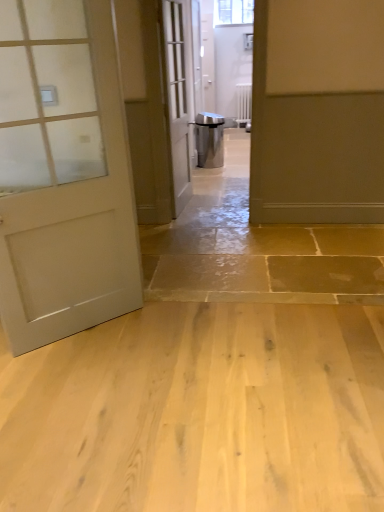
Locate an element on the screen. matte gray door at right, which is the first door from back to front is located at coordinates (317, 112).

Locate an element on the screen. The width and height of the screenshot is (384, 512). white glass door at center, the 2th door when ordered from back to front is located at coordinates (179, 96).

Describe the element at coordinates (63, 174) in the screenshot. The height and width of the screenshot is (512, 384). I see `matte white door at left, the third door viewed from the back` at that location.

I want to click on white painted metal radiator at center, so click(244, 104).

Measure the distance between point (x=237, y=16) and camera.

Point (x=237, y=16) is 7.30 meters away from camera.

Where is `clear glass window at upper center`? The image size is (384, 512). clear glass window at upper center is located at coordinates (233, 12).

What are the coordinates of `matte gray door at right, the third door when ordered from front to back` in the screenshot? It's located at (317, 112).

The width and height of the screenshot is (384, 512). I want to click on concrete located below the white painted metal radiator at center (from the image's perspective), so click(x=199, y=412).

Who is smaller, light brown wood flooring at center or white painted metal radiator at center?

Smaller between the two is white painted metal radiator at center.

Which is closer to the camera, (23,422) or (251,110)?

The point (23,422) is closer.

Does white painted metal radiator at center have a lesser width compared to white glass door at center, the second door in the front-to-back sequence?

Correct, the width of white painted metal radiator at center is less than that of white glass door at center, the second door in the front-to-back sequence.

Which is further, (239,102) or (178,5)?

The point (239,102) is more distant.

Looking at this image, does white painted metal radiator at center have a smaller size compared to white glass door at center, the second door in the front-to-back sequence?

Correct, white painted metal radiator at center occupies less space than white glass door at center, the second door in the front-to-back sequence.

Could white glass door at center, which appears as the 2th door when viewed from the left, be considered to be inside white painted metal radiator at center?

No, white painted metal radiator at center does not contain white glass door at center, which appears as the 2th door when viewed from the left.

What's the angular difference between clear glass window at upper center and matte gray door at right, arranged as the 1th door when viewed from the right,'s facing directions?

3.41 degrees separate the facing orientations of clear glass window at upper center and matte gray door at right, arranged as the 1th door when viewed from the right.

Is clear glass window at upper center aimed at matte gray door at right, the third door when ordered from front to back?

Yes, clear glass window at upper center is facing matte gray door at right, the third door when ordered from front to back.

Can you confirm if clear glass window at upper center is positioned to the left of matte gray door at right, the third door when ordered from front to back?

Indeed, clear glass window at upper center is positioned on the left side of matte gray door at right, the third door when ordered from front to back.

Find the location of a particular element. window above the matte gray door at right, which is counted as the 3th door, starting from the left (from a real-world perspective) is located at coordinates (233, 12).

How many degrees apart are the facing directions of matte gray door at right, arranged as the 1th door when viewed from the right, and white painted metal radiator at center?

3.41 degrees separate the facing orientations of matte gray door at right, arranged as the 1th door when viewed from the right, and white painted metal radiator at center.

Is white painted metal radiator at center located within matte gray door at right, arranged as the 1th door when viewed from the right?

No, white painted metal radiator at center is located outside of matte gray door at right, arranged as the 1th door when viewed from the right.

Does matte gray door at right, the third door when ordered from front to back, turn towards white painted metal radiator at center?

No, matte gray door at right, the third door when ordered from front to back, does not turn towards white painted metal radiator at center.

From a real-world perspective, is matte gray door at right, which is the first door from back to front, under white painted metal radiator at center?

No.

Can you confirm if white glass door at center, the 2th door when ordered from back to front, is thinner than light brown wood flooring at center?

Yes, white glass door at center, the 2th door when ordered from back to front, is thinner than light brown wood flooring at center.

From a real-world perspective, is white glass door at center, arranged as the 2th door when viewed from the right, located higher than light brown wood flooring at center?

Yes.

Is white glass door at center, the 2th door when ordered from back to front, oriented towards light brown wood flooring at center?

No, white glass door at center, the 2th door when ordered from back to front, does not turn towards light brown wood flooring at center.

Between matte white door at left, the first door viewed from the front, and white painted metal radiator at center, which one appears on the right side from the viewer's perspective?

white painted metal radiator at center is more to the right.

What's the angular difference between matte white door at left, positioned as the third door in right-to-left order, and white painted metal radiator at center's facing directions?

There is a 35.3-degree angle between the facing directions of matte white door at left, positioned as the third door in right-to-left order, and white painted metal radiator at center.

From the image's perspective, is matte white door at left, which is the 1th door from left to right, on top of white painted metal radiator at center?

No, from the image's perspective, matte white door at left, which is the 1th door from left to right, is not on top of white painted metal radiator at center.

From a real-world perspective, is matte white door at left, the first door viewed from the front, under white painted metal radiator at center?

Actually, matte white door at left, the first door viewed from the front, is physically above white painted metal radiator at center in the real world.

Considering the relative sizes of white painted metal radiator at center and matte white door at left, the third door viewed from the back, in the image provided, is white painted metal radiator at center bigger than matte white door at left, the third door viewed from the back,?

Answer: No, white painted metal radiator at center is not bigger than matte white door at left, the third door viewed from the back.

Can we say white painted metal radiator at center lies outside matte white door at left, the third door viewed from the back?

Yes, white painted metal radiator at center is located beyond the bounds of matte white door at left, the third door viewed from the back.

Does white painted metal radiator at center lie behind matte white door at left, which is the 1th door from left to right?

Yes, it is behind matte white door at left, which is the 1th door from left to right.

Where is `concrete directly beneath the white painted metal radiator at center (from a real-world perspective)`? The image size is (384, 512). concrete directly beneath the white painted metal radiator at center (from a real-world perspective) is located at coordinates (199, 412).

From a real-world perspective, which door is the 3rd one above the white painted metal radiator at center? Please provide its 2D coordinates.

[(179, 96)]

From the image, which object appears to be farther from white glass door at center, arranged as the 2th door when viewed from the right, clear glass window at upper center or matte white door at left, the third door viewed from the back?

Among the two, clear glass window at upper center is located further to white glass door at center, arranged as the 2th door when viewed from the right.

Which object lies further to the anchor point white glass door at center, which appears as the 2th door when viewed from the left, white painted metal radiator at center or clear glass window at upper center?

clear glass window at upper center is positioned further to the anchor white glass door at center, which appears as the 2th door when viewed from the left.

Based on their spatial positions, is white glass door at center, the 2th door when ordered from back to front, or clear glass window at upper center further from white painted metal radiator at center?

The object further to white painted metal radiator at center is white glass door at center, the 2th door when ordered from back to front.

Based on their spatial positions, is matte gray door at right, which is the first door from back to front, or white painted metal radiator at center further from white glass door at center, which appears as the 2th door when viewed from the left?

white painted metal radiator at center is further to white glass door at center, which appears as the 2th door when viewed from the left.

Based on their spatial positions, is white painted metal radiator at center or matte gray door at right, arranged as the 1th door when viewed from the right, closer to light brown wood flooring at center?

Among the two, matte gray door at right, arranged as the 1th door when viewed from the right, is located nearer to light brown wood flooring at center.

From the image, which object appears to be farther from white painted metal radiator at center, light brown wood flooring at center or matte gray door at right, the third door when ordered from front to back?

light brown wood flooring at center lies further to white painted metal radiator at center than the other object.

From the image, which object appears to be farther from matte gray door at right, which is counted as the 3th door, starting from the left, white painted metal radiator at center or clear glass window at upper center?

clear glass window at upper center is further to matte gray door at right, which is counted as the 3th door, starting from the left.

Considering their positions, is matte gray door at right, the third door when ordered from front to back, positioned further to matte white door at left, positioned as the third door in right-to-left order, than white glass door at center, which appears as the 2th door when viewed from the left?

white glass door at center, which appears as the 2th door when viewed from the left, is positioned further to the anchor matte white door at left, positioned as the third door in right-to-left order.

In order to click on door between white glass door at center, the second door in the front-to-back sequence, and white painted metal radiator at center from front to back in this screenshot , I will do `click(317, 112)`.

In order to click on window between matte gray door at right, arranged as the 1th door when viewed from the right, and white painted metal radiator at center in the front-back direction in this screenshot , I will do `click(233, 12)`.

The image size is (384, 512). I want to click on door located between light brown wood flooring at center and white glass door at center, the second door in the front-to-back sequence, in the depth direction, so click(63, 174).

The width and height of the screenshot is (384, 512). I want to click on window between light brown wood flooring at center and white painted metal radiator at center from front to back, so click(233, 12).